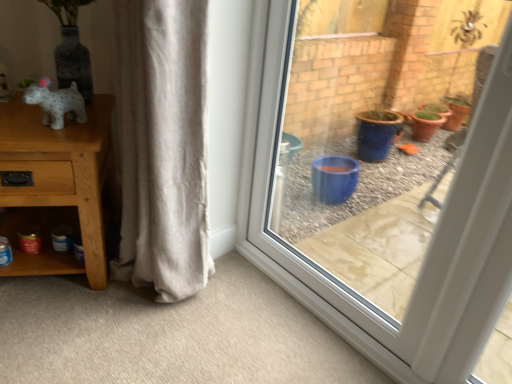
Question: Do you think beige cotton curtain at center is within wooden table at left, or outside of it?

Choices:
 (A) outside
 (B) inside

Answer: (A)

Question: In terms of height, does beige cotton curtain at center look taller or shorter compared to wooden table at left?

Choices:
 (A) short
 (B) tall

Answer: (B)

Question: Estimate the real-world distances between objects in this image. Which object is closer to the transparent glass window at center?

Choices:
 (A) wooden table at left
 (B) beige cotton curtain at center
 (C) speckled white dog at left

Answer: (B)

Question: Which object is positioned farthest from the beige cotton curtain at center?

Choices:
 (A) speckled white dog at left
 (B) transparent glass window at center
 (C) wooden table at left

Answer: (B)